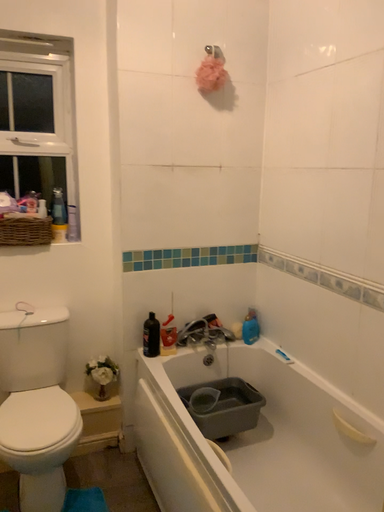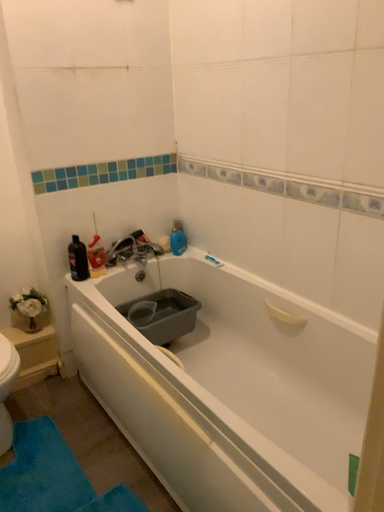
Question: How did the camera likely rotate when shooting the video?

Choices:
 (A) rotated left
 (B) rotated right

Answer: (B)